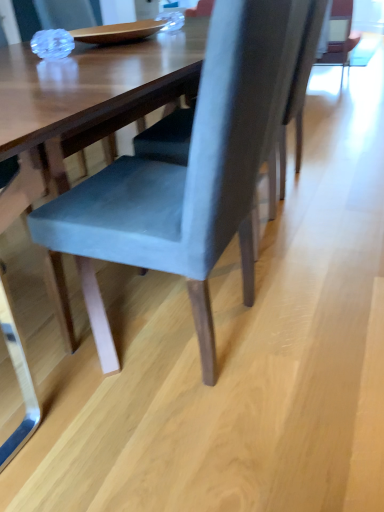
Question: From a real-world perspective, is velvet blue chair at center, placed as the 1th chair when sorted from front to back, positioned above or below suede-like gray chair at center, marked as the first chair in a back-to-front arrangement?

Choices:
 (A) above
 (B) below

Answer: (A)

Question: Is velvet blue chair at center, the 2th chair from the back, wider or thinner than suede-like gray chair at center, the 2th chair viewed from the front?

Choices:
 (A) thin
 (B) wide

Answer: (A)

Question: From the image's perspective, is velvet blue chair at center, the 2th chair from the back, positioned above or below suede-like gray chair at center, the 2th chair viewed from the front?

Choices:
 (A) above
 (B) below

Answer: (B)

Question: Considering the positions of suede-like gray chair at center, marked as the first chair in a back-to-front arrangement, and velvet blue chair at center, the 2th chair from the back, in the image, is suede-like gray chair at center, marked as the first chair in a back-to-front arrangement, taller or shorter than velvet blue chair at center, the 2th chair from the back,?

Choices:
 (A) tall
 (B) short

Answer: (B)

Question: Would you say suede-like gray chair at center, marked as the first chair in a back-to-front arrangement, is inside or outside velvet blue chair at center, placed as the 1th chair when sorted from front to back?

Choices:
 (A) inside
 (B) outside

Answer: (B)

Question: Considering the positions of point (281, 160) and point (46, 204), is point (281, 160) closer or farther from the camera than point (46, 204)?

Choices:
 (A) farther
 (B) closer

Answer: (A)

Question: Based on their sizes in the image, would you say suede-like gray chair at center, marked as the first chair in a back-to-front arrangement, is bigger or smaller than velvet blue chair at center, placed as the 1th chair when sorted from front to back?

Choices:
 (A) big
 (B) small

Answer: (B)